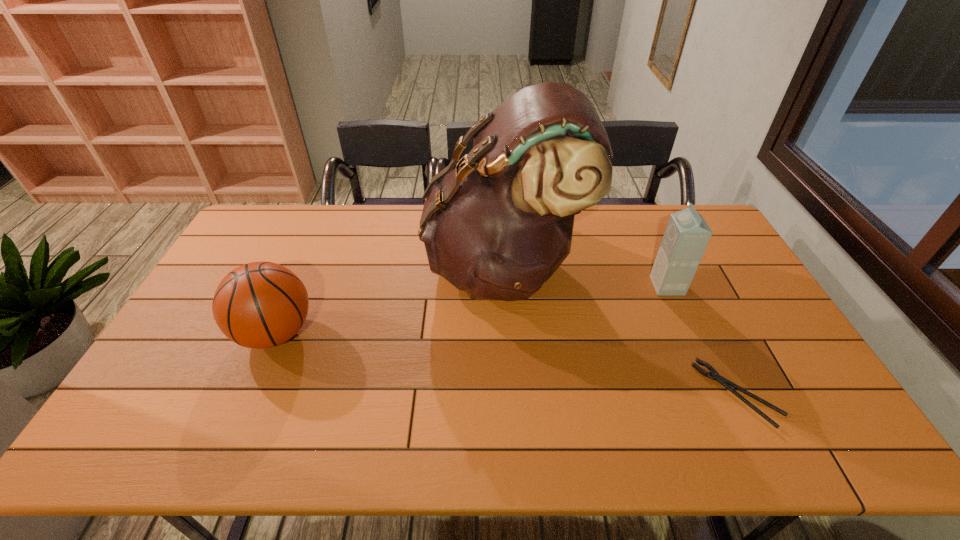
Identify the location of vacant space that satisfies the following two spatial constraints: 1. on the front label of the tongs; 2. on the left side of the second tallest object. The width and height of the screenshot is (960, 540). (715, 394).

Locate an element on the screen. The image size is (960, 540). free space that satisfies the following two spatial constraints: 1. at the front of the tongs with buckles; 2. on the right side of the tallest object is located at coordinates (510, 394).

You are a GUI agent. You are given a task and a screenshot of the screen. Output one action in this format:
    pyautogui.click(x=<x>, y=<y>)
    Task: Click on the free spot that satisfies the following two spatial constraints: 1. at the front of the satchel with buckles; 2. on the right side of the tongs
    The image size is (960, 540).
    Given the screenshot: What is the action you would take?
    pyautogui.click(x=510, y=394)